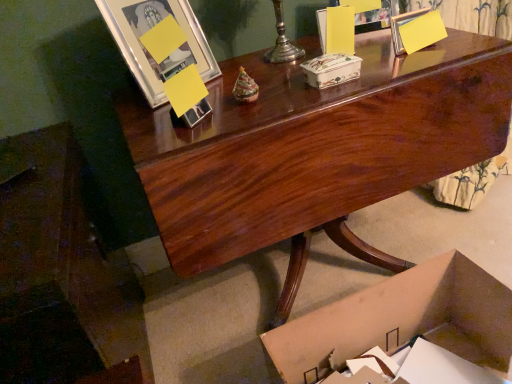
In order to click on vacant space in front of porcelain floral box at center, the second box when ordered from bottom to top in this screenshot , I will do `click(332, 95)`.